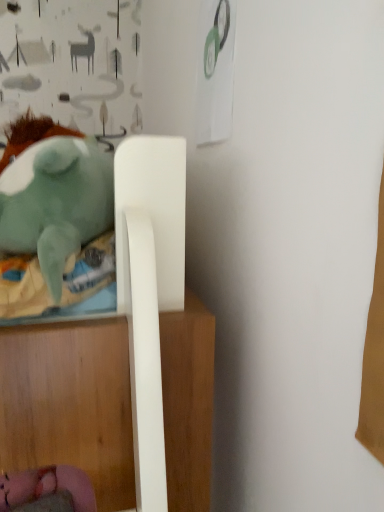
The image size is (384, 512). I want to click on green plush toy at left, so click(55, 225).

Image resolution: width=384 pixels, height=512 pixels. What do you see at coordinates (55, 225) in the screenshot? I see `green plush toy at left` at bounding box center [55, 225].

This screenshot has height=512, width=384. What are the coordinates of `green plush toy at left` in the screenshot? It's located at (55, 225).